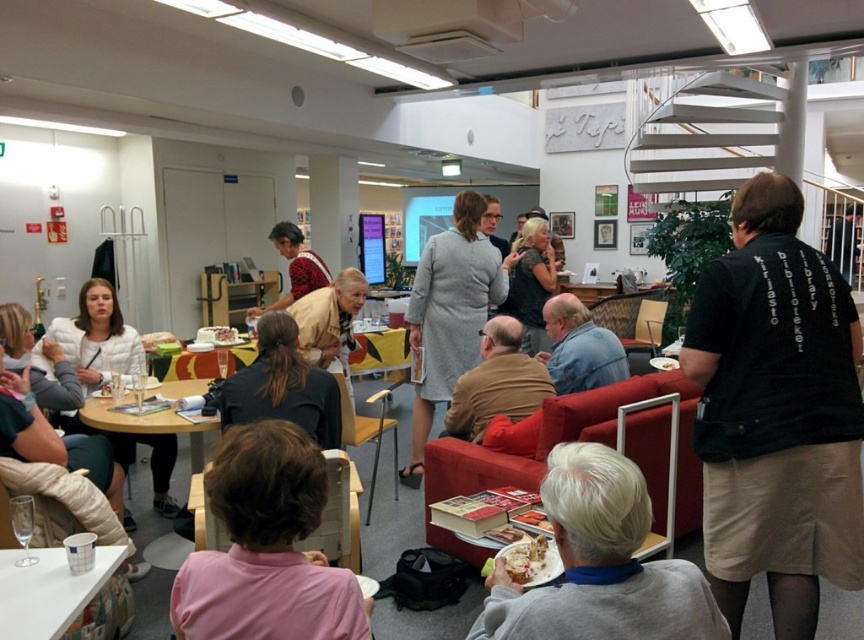
Does wooden table at center appear over white cake at center?

Incorrect, wooden table at center is not positioned above white cake at center.

Is point (166, 417) behind point (237, 333)?

No, it is in front of (237, 333).

This screenshot has height=640, width=864. In order to click on wooden table at center in this screenshot , I will do (147, 424).

Which of these two, black fabric library at right or white paper cup at lower left, stands taller?

With more height is black fabric library at right.

Is point (817, 488) farther from viewer compared to point (0, 604)?

Yes, point (817, 488) is farther from viewer.

Identify the location of black fabric library at right. The image size is (864, 640). (776, 413).

Does pink fabric shirt at lower left have a greater height compared to black dress at center?

Incorrect, pink fabric shirt at lower left's height is not larger of black dress at center's.

What do you see at coordinates (265, 547) in the screenshot? This screenshot has height=640, width=864. I see `pink fabric shirt at lower left` at bounding box center [265, 547].

I want to click on pink fabric shirt at lower left, so click(x=265, y=547).